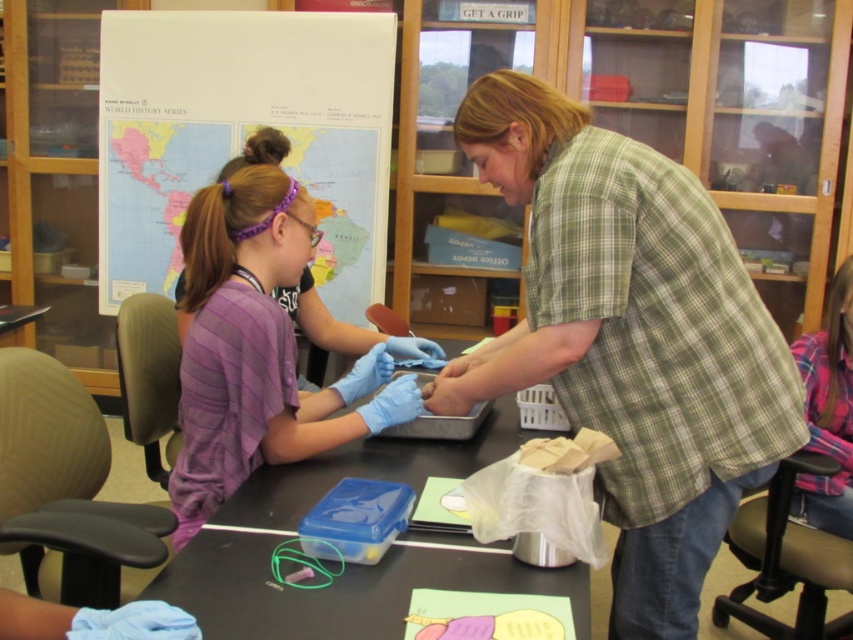
Question: Can you confirm if green plaid shirt at center is positioned to the left of black plastic table at center?

Choices:
 (A) yes
 (B) no

Answer: (B)

Question: Considering the real-world distances, which object is farthest from the purple striped shirt at left?

Choices:
 (A) black plastic table at center
 (B) green plaid shirt at center

Answer: (B)

Question: Observing the image, what is the correct spatial positioning of purple striped shirt at left in reference to black plastic table at center?

Choices:
 (A) below
 (B) above

Answer: (B)

Question: Among these objects, which one is nearest to the camera?

Choices:
 (A) green plaid shirt at center
 (B) purple striped shirt at left

Answer: (A)

Question: Is green plaid shirt at center further to camera compared to black plastic table at center?

Choices:
 (A) yes
 (B) no

Answer: (A)

Question: Considering the real-world distances, which object is farthest from the purple striped shirt at left?

Choices:
 (A) black plastic table at center
 (B) world map poster at upper left
 (C) green plaid shirt at center

Answer: (B)